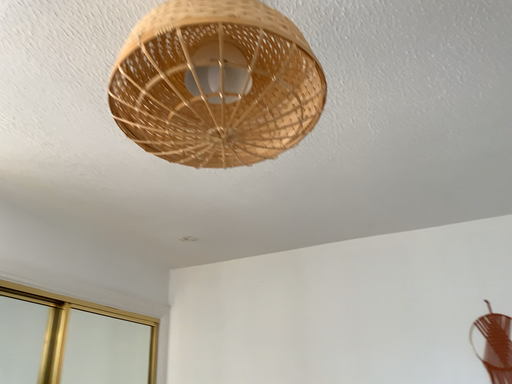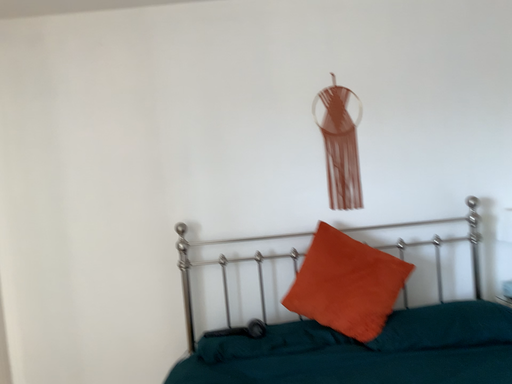
Question: Which way did the camera rotate in the video?

Choices:
 (A) rotated upward
 (B) rotated downward

Answer: (B)